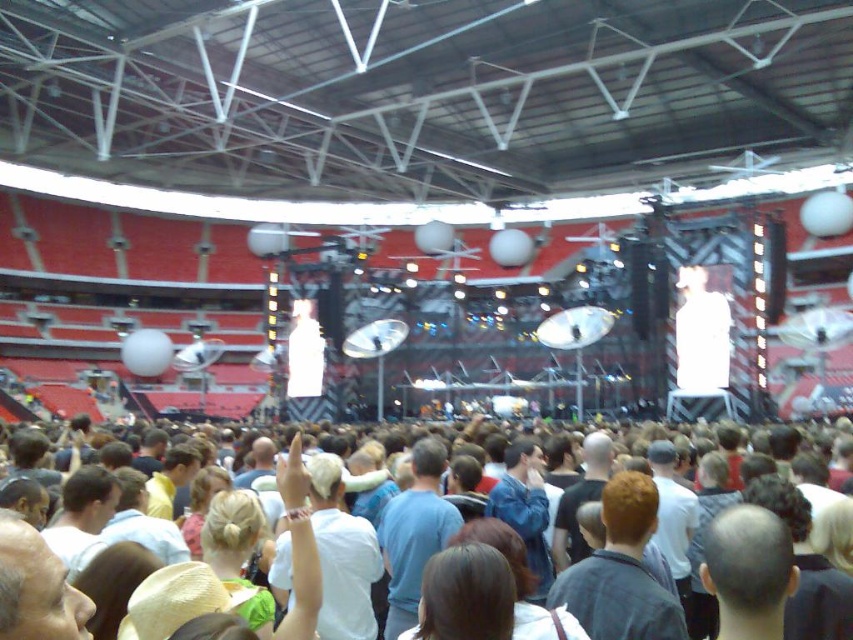
You are a photographer at the concert and want to capture both the light brown hair at lower left and the dark blue shirt at center in a single shot. Which object should you focus on first to ensure both are in frame?

You should focus on the dark blue shirt at center first because it is larger in size compared to the light brown hair at lower left, making it easier to frame both in the shot.

From the picture: You are a stagehand preparing to move a 50 meter long banner from the light brown hair at lower left to the white cotton crowd at center. Can you safely transport the banner without it dragging on the ground?

The distance between the light brown hair at lower left and the white cotton crowd at center is 46.70 meters. Since the banner is 50 meters long, it would be too long to transport safely without dragging on the ground.

You are standing at the entrance of the stadium and looking towards the stage. Where exactly is the white cotton crowd at center located in terms of coordinates?

The white cotton crowd at center is located at point coordinates of 0.680 on the x axis and 0.940 on the y axis.